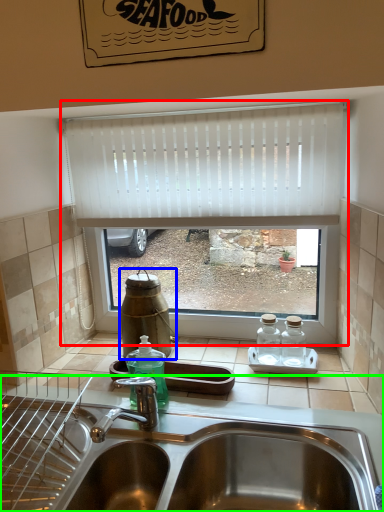
Question: Which object is positioned closest to window (highlighted by a red box)? Select from bottle (highlighted by a blue box) and sink (highlighted by a green box).

Choices:
 (A) bottle
 (B) sink

Answer: (A)